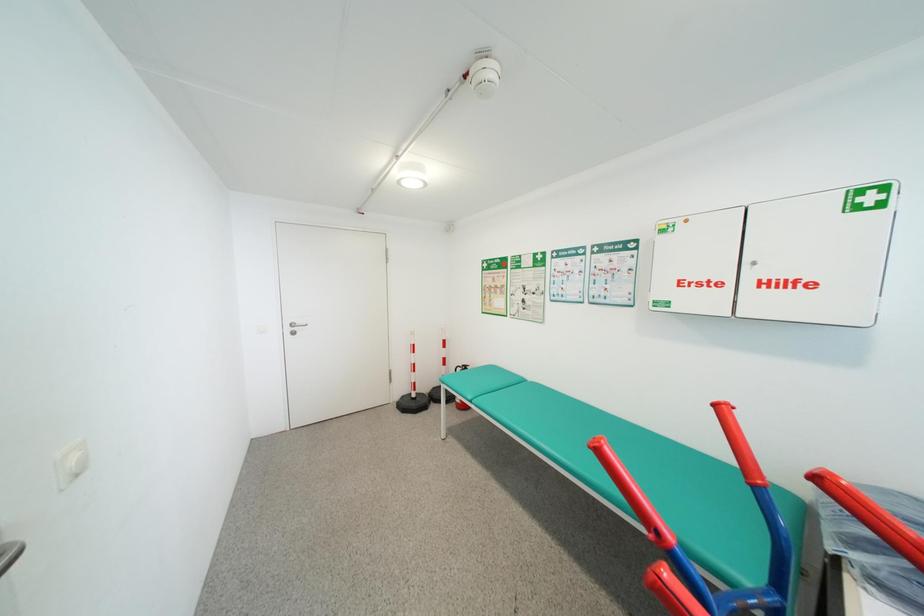
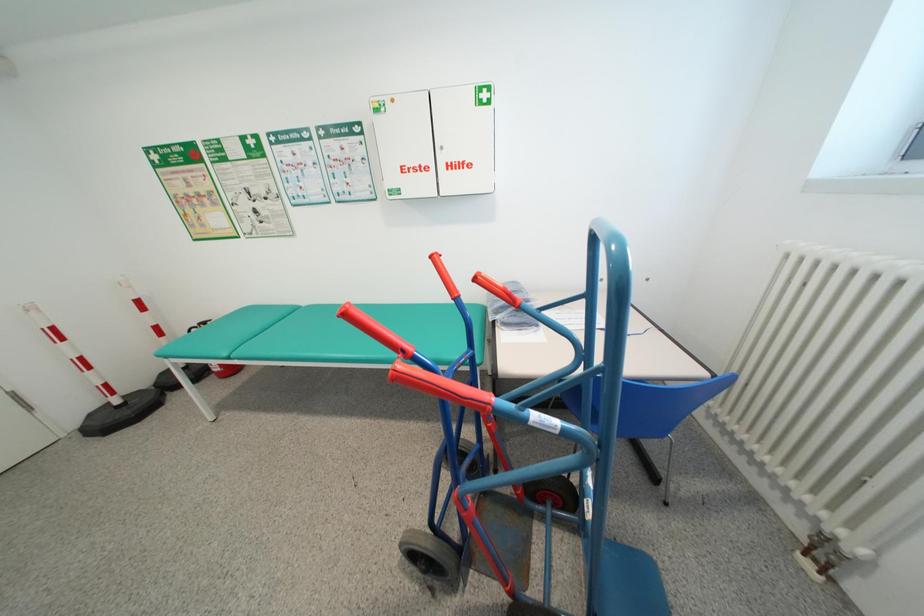
First-person continuous shooting, in which direction is the camera rotating?

The camera's rotation is toward right-down.